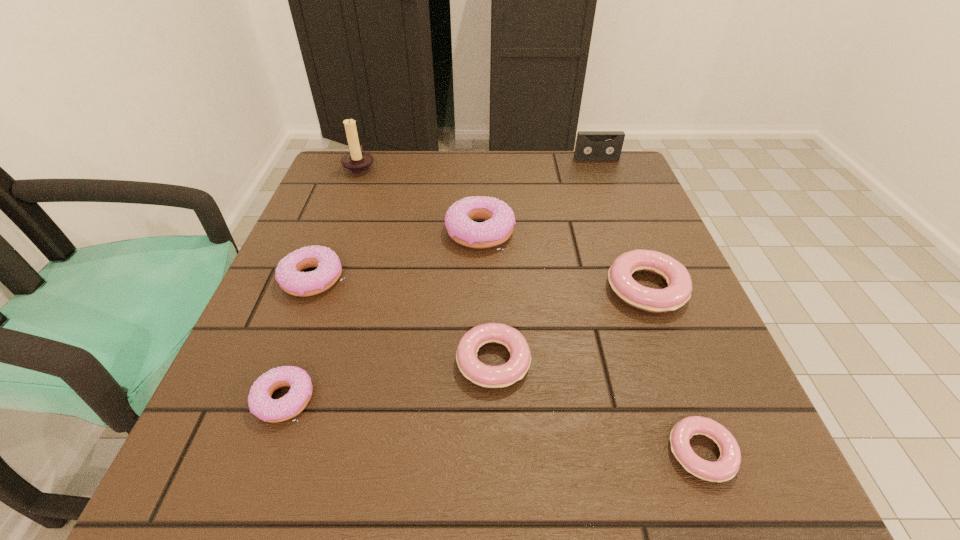
What are the coordinates of `the tallest object` in the screenshot? It's located at (357, 162).

Locate an element on the screen. This screenshot has height=540, width=960. candle holder is located at coordinates (357, 162).

I want to click on videotape, so click(x=590, y=145).

At what (x,y) coordinates should I click in order to perform the action: click on the farthest doughnut. Please return your answer as a coordinate pair (x, y). The height and width of the screenshot is (540, 960). Looking at the image, I should click on (459, 220).

You are a GUI agent. You are given a task and a screenshot of the screen. Output one action in this format:
    pyautogui.click(x=<x>, y=<y>)
    Task: Click on the biggest purple doughnut
    
    Given the screenshot: What is the action you would take?
    pyautogui.click(x=459, y=220)

The width and height of the screenshot is (960, 540). Identify the location of the second smallest purple doughnut. (289, 275).

This screenshot has height=540, width=960. Find the location of `the biggest pink doughnut`. the biggest pink doughnut is located at coordinates (655, 301).

Locate an element on the screen. This screenshot has height=540, width=960. the leftmost pink doughnut is located at coordinates (486, 376).

What are the coordinates of `the second smallest pink doughnut` in the screenshot? It's located at (486, 376).

Locate an element on the screen. The width and height of the screenshot is (960, 540). the nearest purple doughnut is located at coordinates (261, 404).